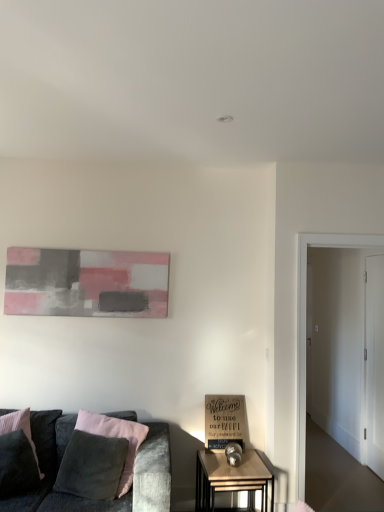
This screenshot has width=384, height=512. Identify the location of vacant area on top of white glossy door at right, placed as the 2th glass door when sorted from right to left (from a real-world perspective). (349, 233).